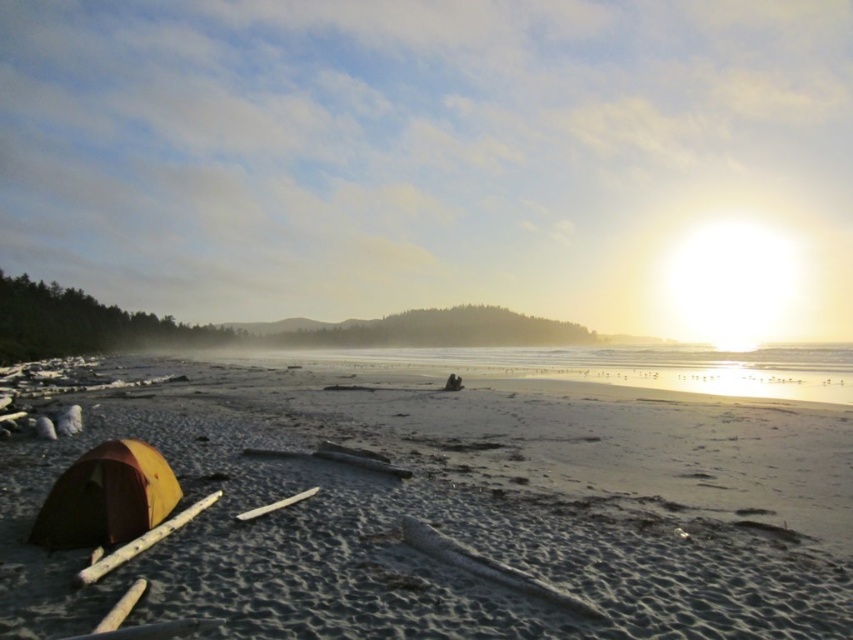
Question: Does smooth sand at lower left lie in front of orange fabric tent at lower left?

Choices:
 (A) yes
 (B) no

Answer: (A)

Question: Which point appears farthest from the camera in this image?

Choices:
 (A) (38, 522)
 (B) (344, 470)

Answer: (B)

Question: Among these points, which one is nearest to the camera?

Choices:
 (A) click(85, 484)
 (B) click(514, 536)

Answer: (A)

Question: Does smooth sand at lower left lie behind orange fabric tent at lower left?

Choices:
 (A) no
 (B) yes

Answer: (A)

Question: Which object appears farthest from the camera in this image?

Choices:
 (A) orange fabric tent at lower left
 (B) smooth sand at lower left

Answer: (A)

Question: Can you confirm if smooth sand at lower left is positioned to the right of orange fabric tent at lower left?

Choices:
 (A) yes
 (B) no

Answer: (B)